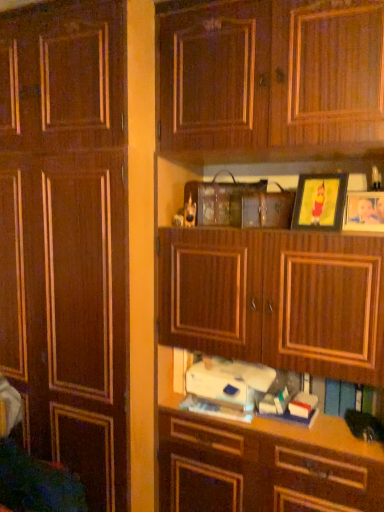
Question: Considering the relative sizes of matte gold picture frame at upper right, which is the 2th picture frame in right-to-left order, and white matte book at center in the image provided, is matte gold picture frame at upper right, which is the 2th picture frame in right-to-left order, wider than white matte book at center?

Choices:
 (A) yes
 (B) no

Answer: (B)

Question: Does matte gold picture frame at upper right, which is the 2th picture frame in right-to-left order, have a smaller size compared to white matte book at center?

Choices:
 (A) no
 (B) yes

Answer: (B)

Question: From the image's perspective, is matte gold picture frame at upper right, placed as the first picture frame when sorted from left to right, below white matte book at center?

Choices:
 (A) no
 (B) yes

Answer: (A)

Question: Is matte gold picture frame at upper right, placed as the first picture frame when sorted from left to right, directly adjacent to white matte book at center?

Choices:
 (A) yes
 (B) no

Answer: (B)

Question: Is matte gold picture frame at upper right, which is the 2th picture frame in right-to-left order, taller than white matte book at center?

Choices:
 (A) yes
 (B) no

Answer: (A)

Question: Visually, is matte gold picture frame at upper right, placed as the first picture frame when sorted from left to right, positioned to the left or to the right of white matte book at center?

Choices:
 (A) right
 (B) left

Answer: (A)

Question: From a real-world perspective, is matte gold picture frame at upper right, which is the 2th picture frame in right-to-left order, positioned above or below white matte book at center?

Choices:
 (A) above
 (B) below

Answer: (A)

Question: From the image's perspective, is matte gold picture frame at upper right, placed as the first picture frame when sorted from left to right, located above or below white matte book at center?

Choices:
 (A) above
 (B) below

Answer: (A)

Question: In terms of size, does matte gold picture frame at upper right, which is the 2th picture frame in right-to-left order, appear bigger or smaller than white matte book at center?

Choices:
 (A) small
 (B) big

Answer: (A)

Question: Is white matte book at center wider or thinner than wooden cabinet at center?

Choices:
 (A) thin
 (B) wide

Answer: (A)

Question: Is white matte book at center inside the boundaries of wooden cabinet at center, or outside?

Choices:
 (A) outside
 (B) inside

Answer: (A)

Question: From a real-world perspective, is white matte book at center above or below wooden cabinet at center?

Choices:
 (A) below
 (B) above

Answer: (A)

Question: Considering the positions of white matte book at center and wooden cabinet at center in the image, is white matte book at center taller or shorter than wooden cabinet at center?

Choices:
 (A) tall
 (B) short

Answer: (B)

Question: From a real-world perspective, is wooden photo frame at upper right, the 2th picture frame when ordered from left to right, positioned above or below matte gold picture frame at upper right, placed as the first picture frame when sorted from left to right?

Choices:
 (A) below
 (B) above

Answer: (A)

Question: Is wooden photo frame at upper right, the first picture frame when ordered from right to left, in front of or behind matte gold picture frame at upper right, which is the 2th picture frame in right-to-left order, in the image?

Choices:
 (A) behind
 (B) front

Answer: (B)